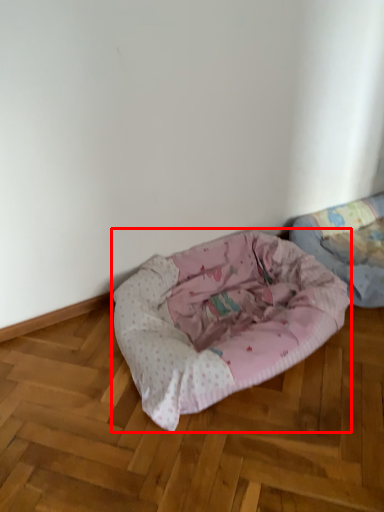
Question: In this image, where is dog bed (annotated by the red box) located relative to dog bed?

Choices:
 (A) right
 (B) left

Answer: (B)